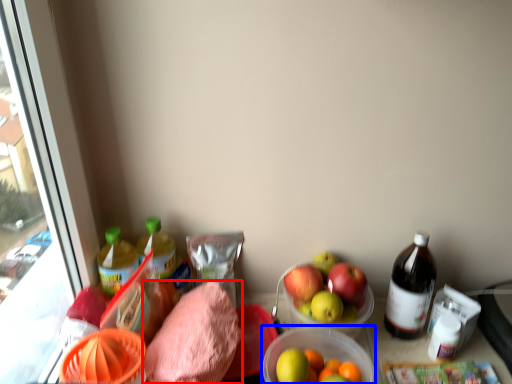
Question: Which object is closer to the camera taking this photo, waste (highlighted by a red box) or bowl (highlighted by a blue box)?

Choices:
 (A) waste
 (B) bowl

Answer: (B)